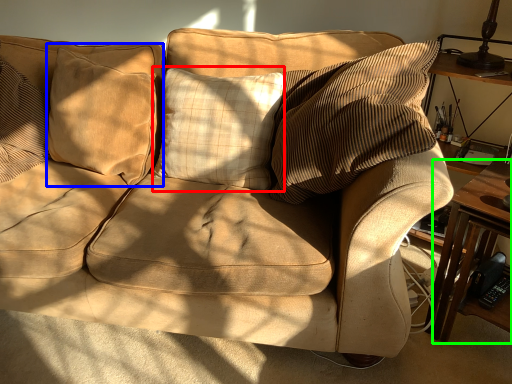
Question: Estimate the real-world distances between objects in this image. Which object is farther from pillow (highlighted by a red box), pillow (highlighted by a blue box) or table (highlighted by a green box)?

Choices:
 (A) pillow
 (B) table

Answer: (B)